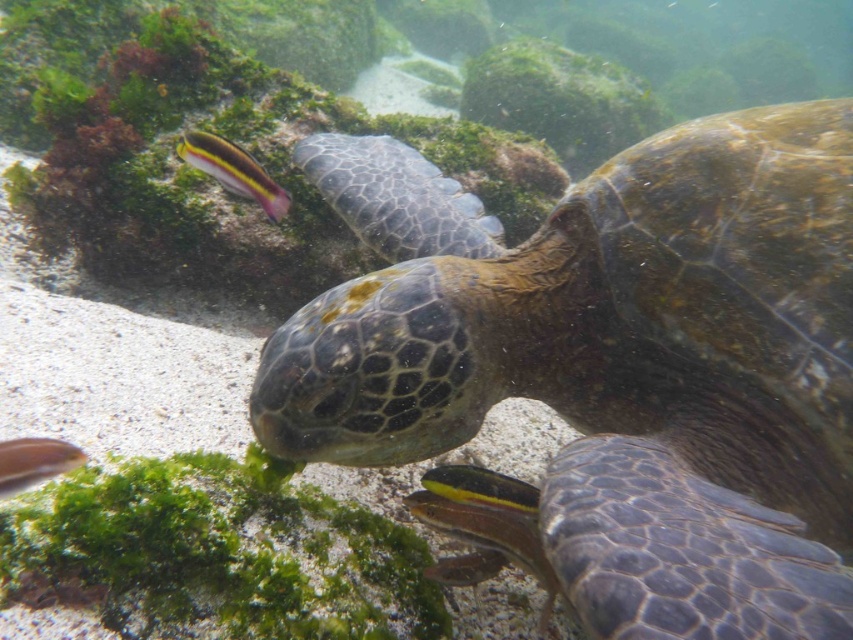
You are a marine biologist observing the underwater scene. You need to determine which object is bigger between the leathery green turtle at center and the shiny silver fish at lower left. Which one is larger?

The leathery green turtle at center is larger than the shiny silver fish at lower left.

You are a scuba diver who wants to place a marker at the closest point to you between point (630,636) and point (41,461). Which point should you choose?

Point (630,636) is closer to the viewer than point (41,461), so you should choose point (630,636).